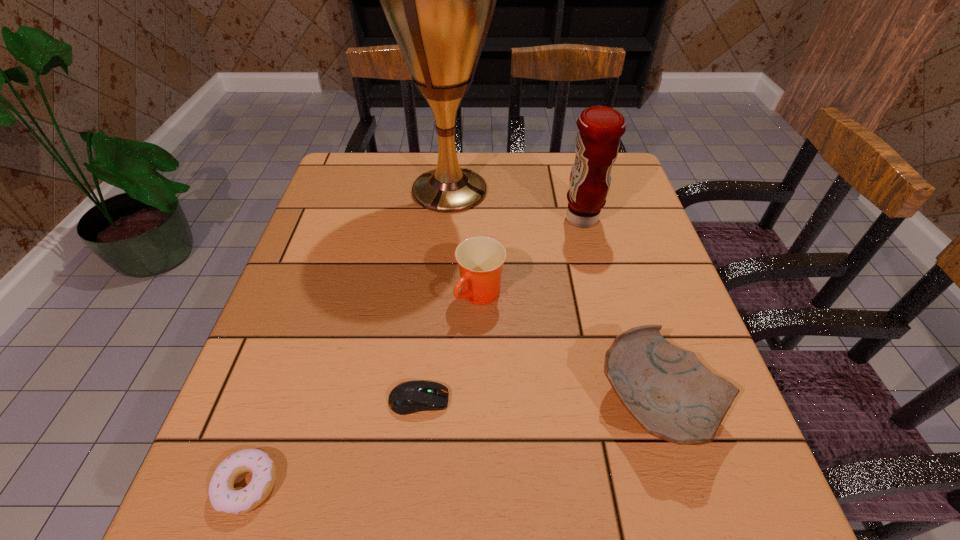
The height and width of the screenshot is (540, 960). In order to click on free space located on the left of the pottery in this screenshot , I will do `click(411, 403)`.

This screenshot has height=540, width=960. Find the location of `free space located 0.110m on the button of the computer equipment`. free space located 0.110m on the button of the computer equipment is located at coordinates [x=511, y=400].

You are a GUI agent. You are given a task and a screenshot of the screen. Output one action in this format:
    pyautogui.click(x=<x>, y=<y>)
    Task: Click on the free space located on the back of the leftmost object
    
    Given the screenshot: What is the action you would take?
    pyautogui.click(x=318, y=284)

Identify the location of object present at the far edge. (439, 0).

Identify the location of object that is at the near edge. This screenshot has height=540, width=960. (224, 498).

Locate an element on the screen. This screenshot has height=540, width=960. object that is at the left edge is located at coordinates (224, 498).

This screenshot has width=960, height=540. Identify the location of condiment at the right edge. (597, 144).

The height and width of the screenshot is (540, 960). I want to click on pottery that is at the right edge, so click(668, 391).

This screenshot has width=960, height=540. I want to click on object that is at the near left corner, so click(224, 498).

In the image, there is a desktop. Where is `free region at the far edge`? This screenshot has width=960, height=540. free region at the far edge is located at coordinates (498, 177).